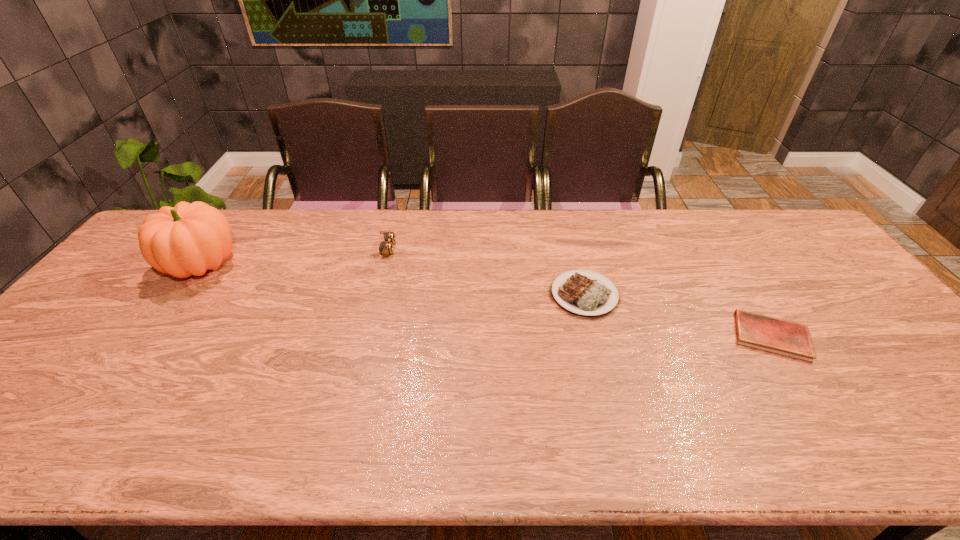
Identify the location of blank space at the near right corner of the desktop. (954, 431).

I want to click on free space between the third tallest object and the diary, so coord(678,315).

Locate an element on the screen. This screenshot has height=540, width=960. vacant region between the second object from right to left and the rightmost object is located at coordinates [678, 315].

The image size is (960, 540). In order to click on empty space that is in between the rightmost object and the second object from right to left in this screenshot , I will do `click(678, 315)`.

This screenshot has height=540, width=960. What are the coordinates of `free area in between the tallest object and the third tallest object` in the screenshot? It's located at (393, 280).

The image size is (960, 540). I want to click on vacant point located between the pumpkin and the second object from right to left, so click(x=393, y=280).

The image size is (960, 540). Identify the location of free spot between the pumpkin and the second shortest object. (393, 280).

I want to click on vacant space that's between the second tallest object and the tallest object, so click(294, 257).

You are a GUI agent. You are given a task and a screenshot of the screen. Output one action in this format:
    pyautogui.click(x=<x>, y=<y>)
    Task: Click on the vacant region between the third shortest object and the leftmost object
    The width and height of the screenshot is (960, 540).
    Given the screenshot: What is the action you would take?
    pyautogui.click(x=294, y=257)

This screenshot has width=960, height=540. In order to click on free area in between the diary and the tallest object in this screenshot , I will do `click(486, 301)`.